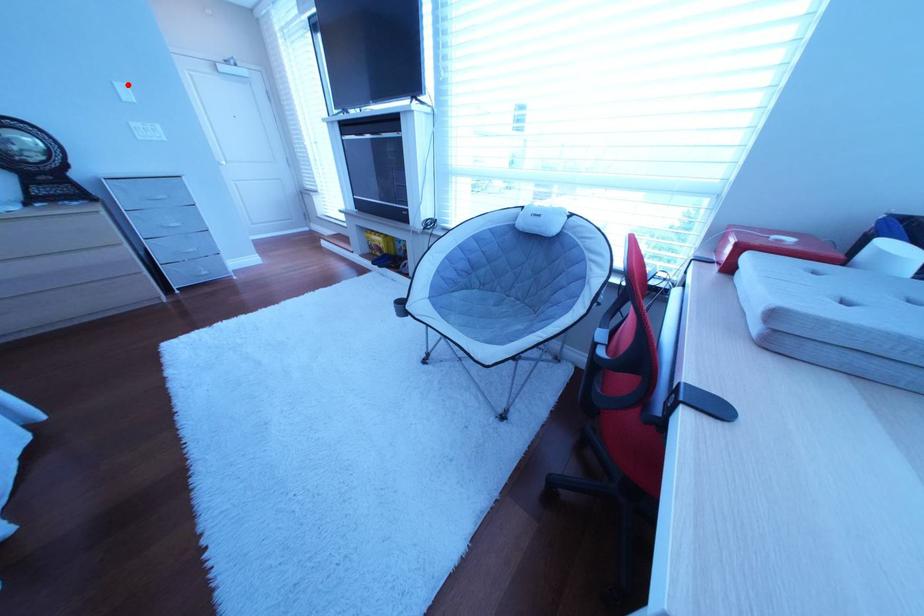
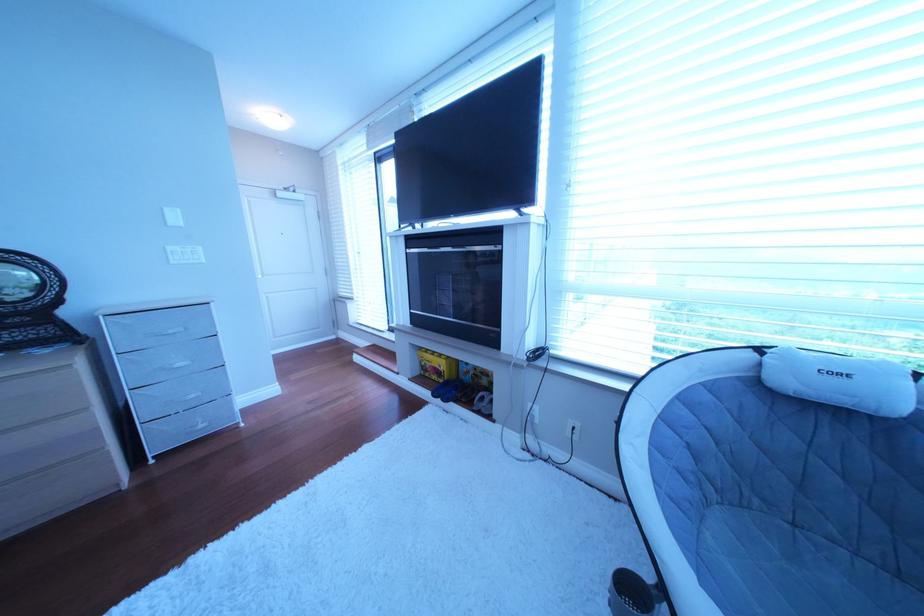
The point at the highlighted location is marked in the first image. Where is the corresponding point in the second image?

(177, 211)